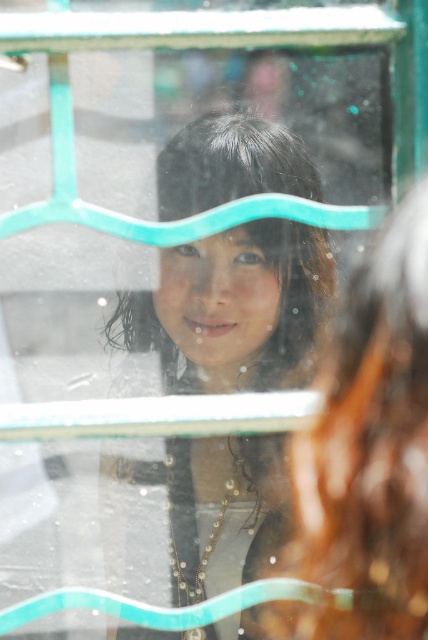
Question: Which point appears farthest from the camera in this image?

Choices:
 (A) (305, 378)
 (B) (424, 541)

Answer: (A)

Question: Is the position of smooth black hair at center less distant than that of smooth brown hair at upper center?

Choices:
 (A) yes
 (B) no

Answer: (B)

Question: Which point appears farthest from the camera in this image?

Choices:
 (A) (418, 419)
 (B) (181, 346)

Answer: (B)

Question: Is smooth black hair at center above smooth brown hair at upper center?

Choices:
 (A) yes
 (B) no

Answer: (A)

Question: Is smooth black hair at center bigger than smooth brown hair at upper center?

Choices:
 (A) yes
 (B) no

Answer: (A)